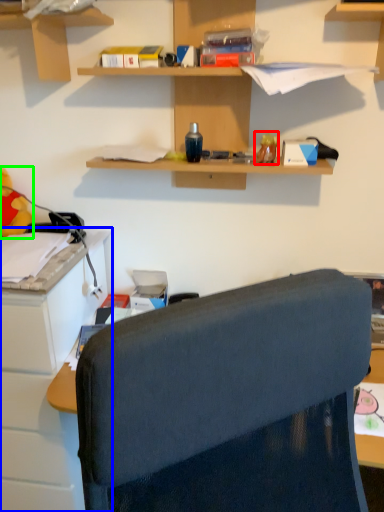
Question: Based on their relative distances, which object is nearer to toy (highlighted by a red box)? Choose from cabinetry (highlighted by a blue box) and toy (highlighted by a green box).

Choices:
 (A) cabinetry
 (B) toy

Answer: (B)